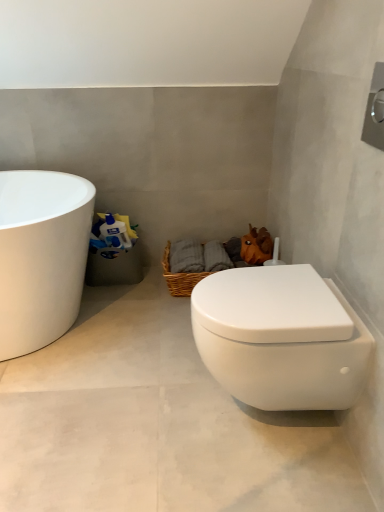
Locate an element on the screen. The height and width of the screenshot is (512, 384). free spot to the left of woven brown basket at center is located at coordinates (136, 304).